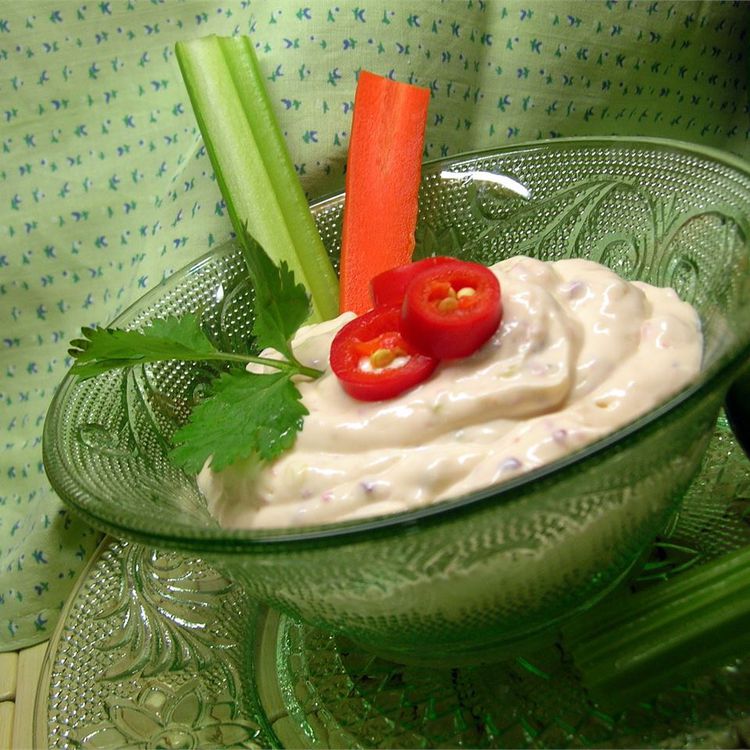
The image size is (750, 750). Find the location of `green glass plate`. green glass plate is located at coordinates (206, 676).